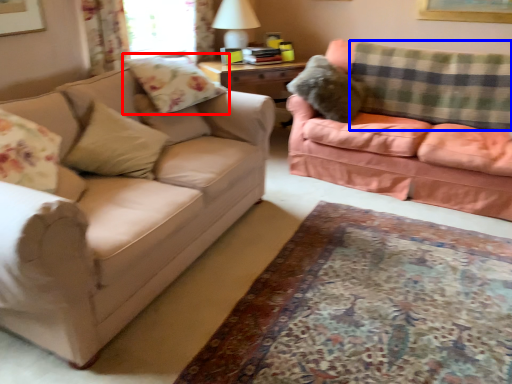
Question: Among these objects, which one is farthest to the camera, pillow (highlighted by a red box) or plaid (highlighted by a blue box)?

Choices:
 (A) pillow
 (B) plaid

Answer: (B)